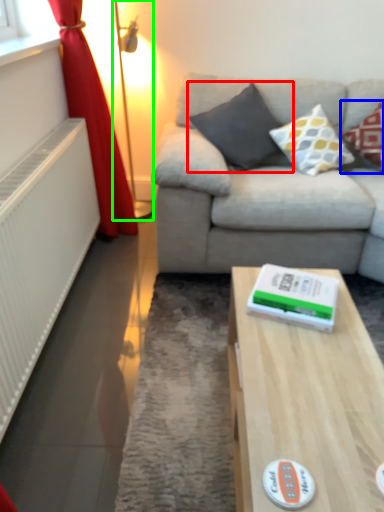
Question: Estimate the real-world distances between objects in this image. Which object is farther from pillow (highlighted by a red box), pillow (highlighted by a blue box) or table lamp (highlighted by a green box)?

Choices:
 (A) pillow
 (B) table lamp

Answer: (B)